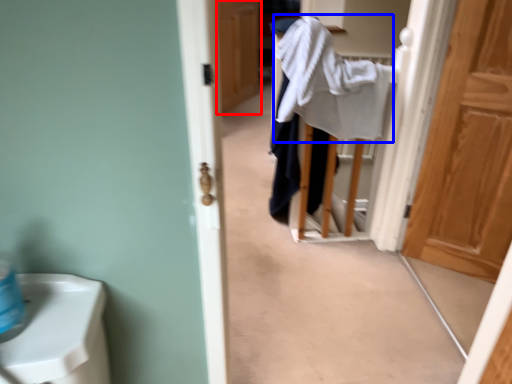
Question: Among these objects, which one is nearest to the camera, door (highlighted by a red box) or bath towel (highlighted by a blue box)?

Choices:
 (A) door
 (B) bath towel

Answer: (B)